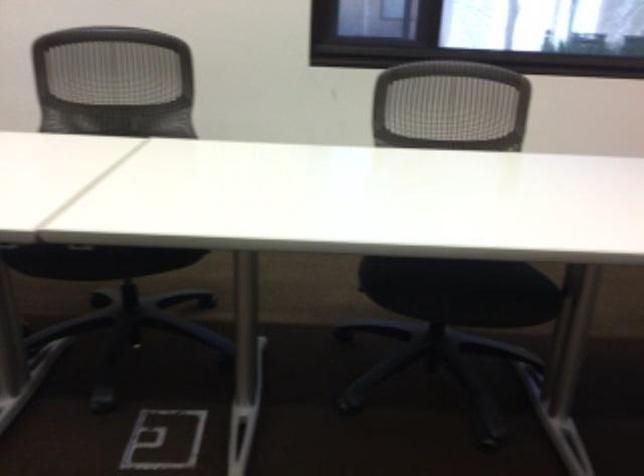
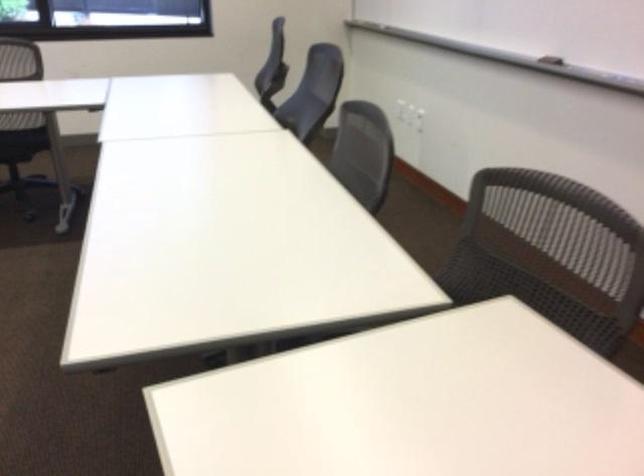
In a continuous first-person perspective shot, in which direction is the camera moving?

The cameraman moved toward right, backward.